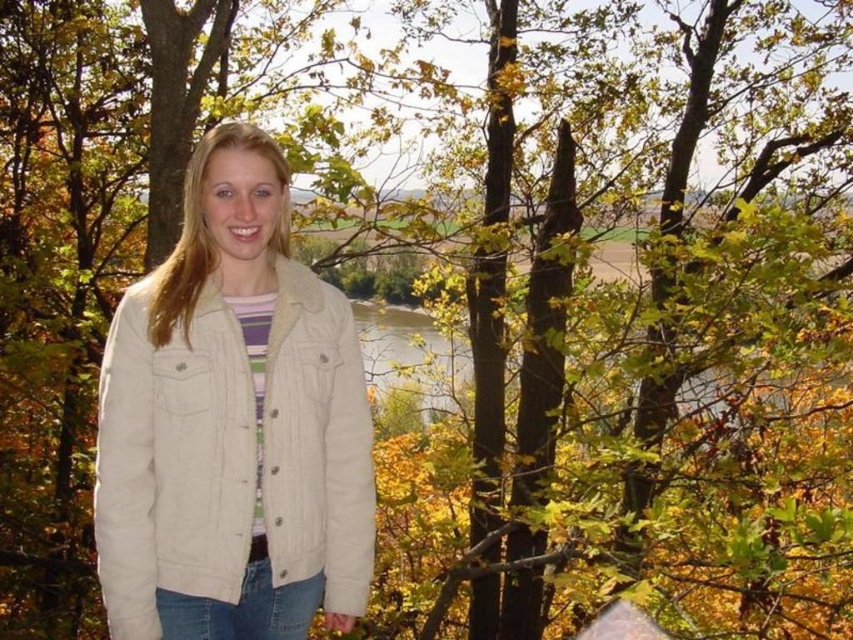
The width and height of the screenshot is (853, 640). Describe the element at coordinates (173, 460) in the screenshot. I see `beige corduroy jacket at center` at that location.

Find the location of `beige corduroy jacket at center`. beige corduroy jacket at center is located at coordinates (173, 460).

This screenshot has height=640, width=853. What are the coordinates of `beige corduroy jacket at center` in the screenshot? It's located at [x=173, y=460].